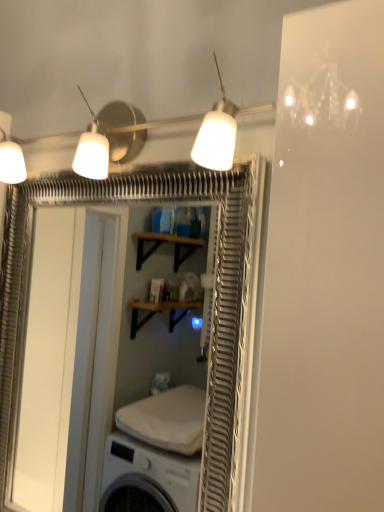
Locate an element on the screen. The height and width of the screenshot is (512, 384). white matte lampshade at upper center is located at coordinates (135, 135).

What do you see at coordinates (135, 135) in the screenshot? The height and width of the screenshot is (512, 384). I see `white matte lampshade at upper center` at bounding box center [135, 135].

The image size is (384, 512). I want to click on white glossy screen door at upper center, so click(210, 306).

The height and width of the screenshot is (512, 384). What do you see at coordinates (210, 306) in the screenshot?
I see `white glossy screen door at upper center` at bounding box center [210, 306].

Image resolution: width=384 pixels, height=512 pixels. Find the location of `white matte lampshade at upper center`. white matte lampshade at upper center is located at coordinates (135, 135).

Visually, is white glossy screen door at upper center positioned to the left or to the right of white matte lampshade at upper center?

Clearly, white glossy screen door at upper center is on the left of white matte lampshade at upper center in the image.

Is white glossy screen door at upper center positioned behind white matte lampshade at upper center?

Yes, the depth of white glossy screen door at upper center is greater than that of white matte lampshade at upper center.

Considering the positions of point (232, 349) and point (93, 158), is point (232, 349) closer or farther from the camera than point (93, 158)?

Point (232, 349) is positioned closer to the camera compared to point (93, 158).

From the image's perspective, which is above, white glossy screen door at upper center or white matte lampshade at upper center?

white matte lampshade at upper center is shown above in the image.

In the scene shown: From a real-world perspective, which object stands above the other?

A: white matte lampshade at upper center, from a real-world perspective.

Can you confirm if white glossy screen door at upper center is thinner than white matte lampshade at upper center?

Correct, the width of white glossy screen door at upper center is less than that of white matte lampshade at upper center.

From their relative heights in the image, would you say white glossy screen door at upper center is taller or shorter than white matte lampshade at upper center?

In the image, white glossy screen door at upper center appears to be taller than white matte lampshade at upper center.

Which of these two, white glossy screen door at upper center or white matte lampshade at upper center, is smaller?

white matte lampshade at upper center is smaller.

Can white matte lampshade at upper center be found inside white glossy screen door at upper center?

No, white matte lampshade at upper center is not a part of white glossy screen door at upper center.

Is white glossy screen door at upper center not near white matte lampshade at upper center?

white glossy screen door at upper center is near white matte lampshade at upper center, not far away.

Could you tell me if white glossy screen door at upper center is facing white matte lampshade at upper center?

No, white glossy screen door at upper center is not aimed at white matte lampshade at upper center.

Could you measure the distance between white glossy screen door at upper center and white matte lampshade at upper center?

20.02 centimeters.

Find the location of a particular element. lamp in front of the white glossy screen door at upper center is located at coordinates (135, 135).

Considering the positions of objects white matte lampshade at upper center and white glossy screen door at upper center in the image provided, who is more to the right, white matte lampshade at upper center or white glossy screen door at upper center?

Positioned to the right is white matte lampshade at upper center.

In the scene shown: Considering the positions of objects white matte lampshade at upper center and white glossy screen door at upper center in the image provided, who is behind, white matte lampshade at upper center or white glossy screen door at upper center?

white glossy screen door at upper center.

Which is less distant, (223,111) or (242,311)?

Point (223,111) is positioned closer to the camera compared to point (242,311).

From the image's perspective, which object appears higher, white matte lampshade at upper center or white glossy screen door at upper center?

white matte lampshade at upper center is shown above in the image.

From a real-world perspective, is white matte lampshade at upper center under white glossy screen door at upper center?

Incorrect, from a real-world perspective, white matte lampshade at upper center is higher than white glossy screen door at upper center.

In terms of width, does white matte lampshade at upper center look wider or thinner when compared to white glossy screen door at upper center?

Considering their sizes, white matte lampshade at upper center looks broader than white glossy screen door at upper center.

From their relative heights in the image, would you say white matte lampshade at upper center is taller or shorter than white glossy screen door at upper center?

Clearly, white matte lampshade at upper center is shorter compared to white glossy screen door at upper center.

Considering the relative sizes of white matte lampshade at upper center and white glossy screen door at upper center in the image provided, is white matte lampshade at upper center smaller than white glossy screen door at upper center?

Indeed, white matte lampshade at upper center has a smaller size compared to white glossy screen door at upper center.

Can we say white matte lampshade at upper center lies outside white glossy screen door at upper center?

white matte lampshade at upper center lies outside white glossy screen door at upper center's area.

Is white matte lampshade at upper center with white glossy screen door at upper center?

white matte lampshade at upper center and white glossy screen door at upper center are not in contact.

Is white matte lampshade at upper center oriented towards white glossy screen door at upper center?

No, white matte lampshade at upper center is not facing towards white glossy screen door at upper center.

This screenshot has width=384, height=512. In order to click on lamp above the white glossy screen door at upper center (from a real-world perspective) in this screenshot , I will do `click(135, 135)`.

In the image, there is a white matte lampshade at upper center. Find the location of `screen door below it (from the image's perspective)`. screen door below it (from the image's perspective) is located at coordinates (210, 306).

Find the location of a particular element. lamp in front of the white glossy screen door at upper center is located at coordinates (135, 135).